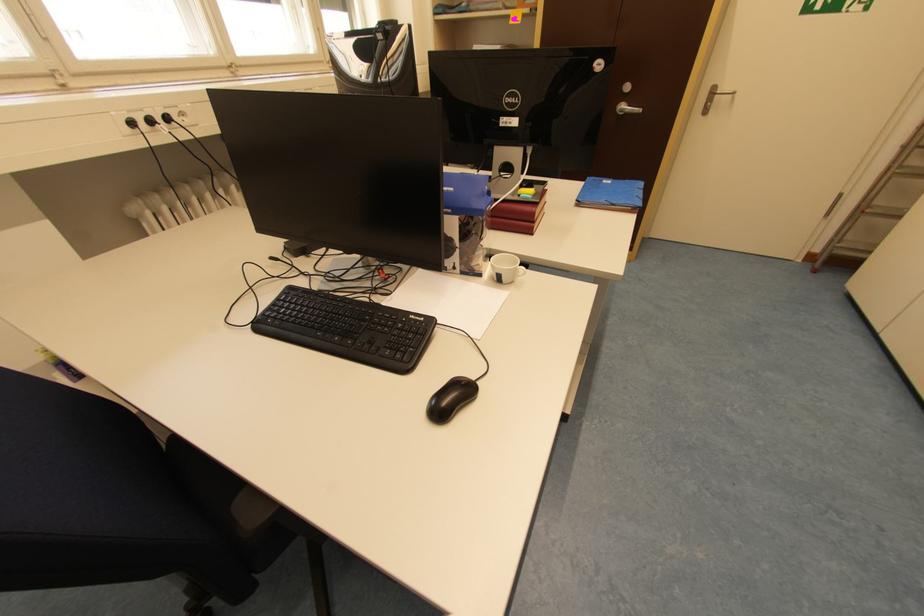
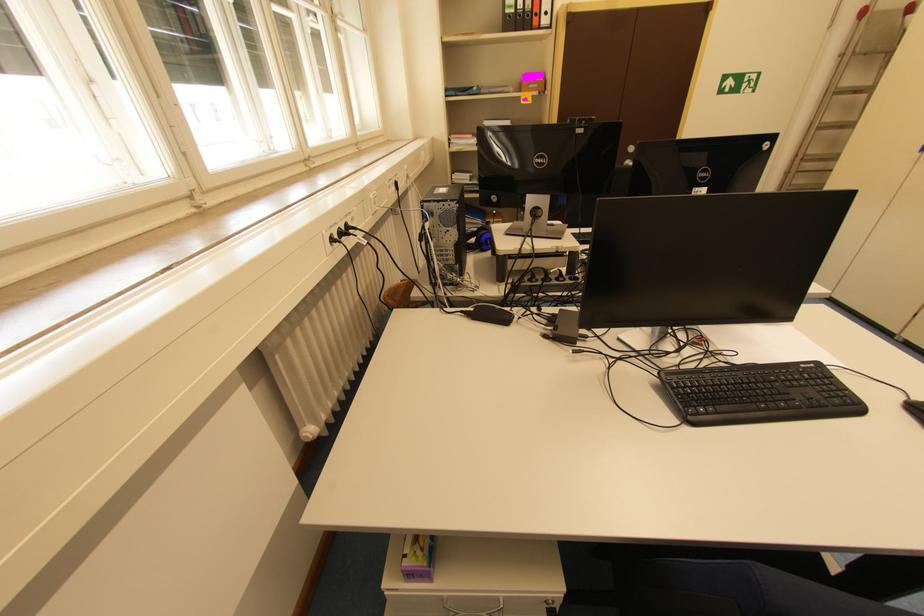
In the second image, find the point that corresponds to point (480, 381) in the first image.

(915, 400)